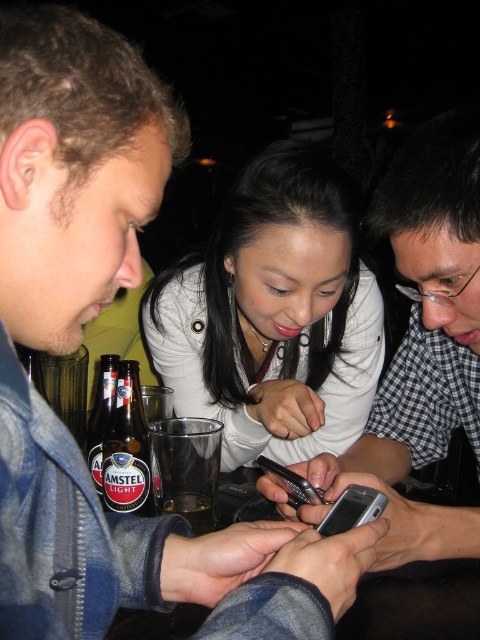
You are a photographer standing 10 inches away from the table. You want to take a photo of both the white matte jacket at center and the checkered fabric shirt at center without moving the subjects. Is there enough space between them to fit both in the frame?

The white matte jacket at center is 7.04 inches away from the checkered fabric shirt at center. Since the photographer is standing 10 inches away, there is enough space between the two subjects to fit both in the frame.

You are a delivery person who needs to place a small package between the amstel light glass bottle at lower left and the silver metallic smartphone at lower center. The package is 10 inches long. Will it fit in the space between them?

The distance between the amstel light glass bottle at lower left and the silver metallic smartphone at lower center is 12.97 inches. Since the package is 10 inches long, it will fit in the space between them as there is enough room.